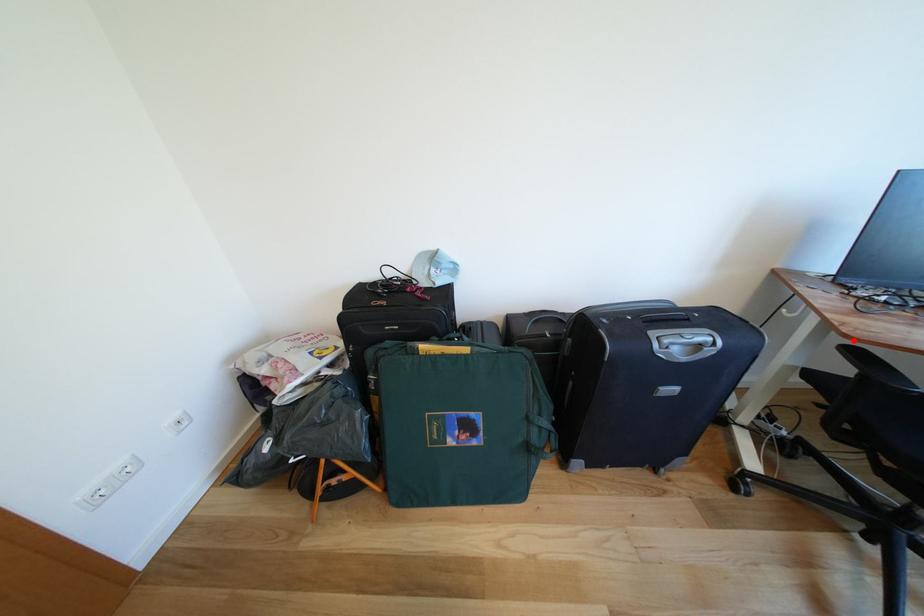
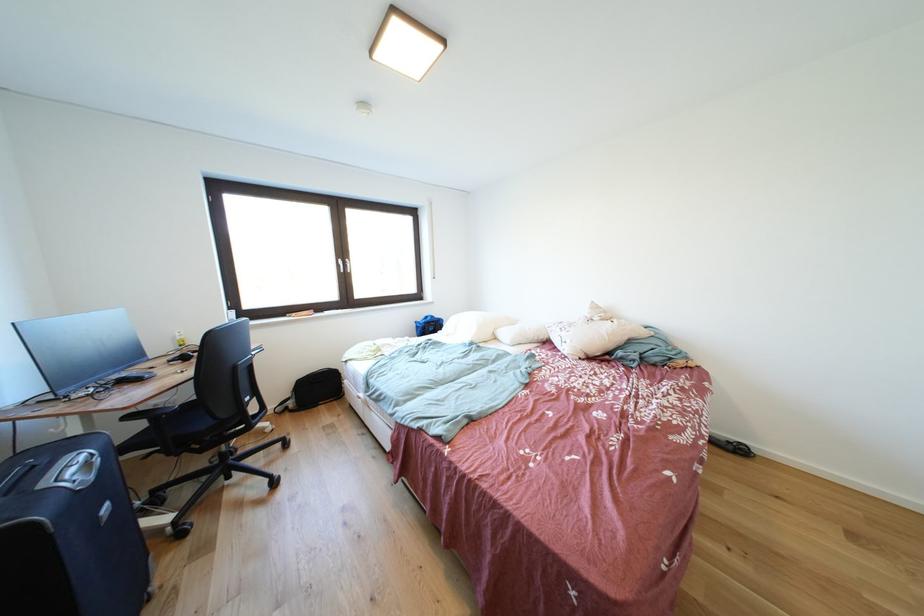
In the second image, find the point that corresponds to the highlighted location in the first image.

(134, 413)